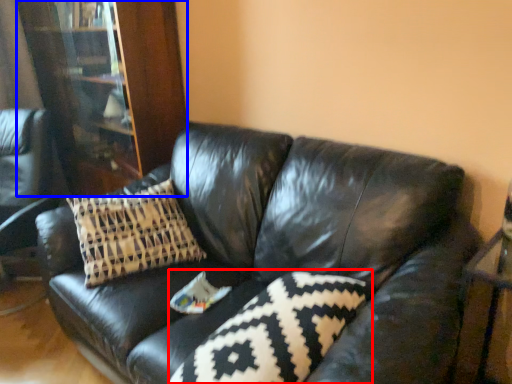
Question: Which of the following is the farthest to the observer, pillow (highlighted by a red box) or bookcase (highlighted by a blue box)?

Choices:
 (A) pillow
 (B) bookcase

Answer: (B)